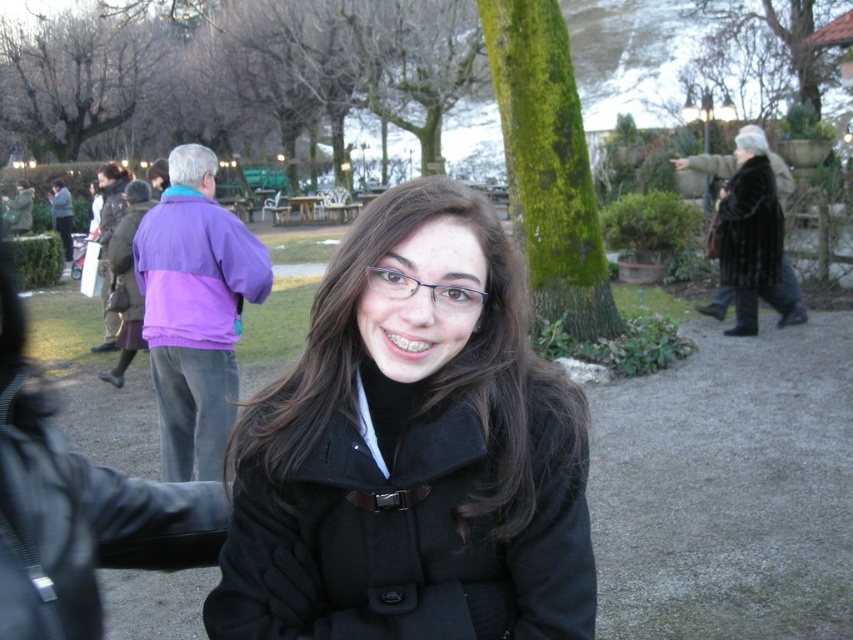
Is black matte coat at lower left wider than black fur coat at right?

Incorrect, black matte coat at lower left's width does not surpass black fur coat at right's.

Is point (45, 592) positioned after point (728, 182)?

No, (45, 592) is closer to viewer.

Identify the location of black matte coat at lower left. (84, 528).

This screenshot has height=640, width=853. I want to click on purple fleece jacket at left, so coord(126,262).

Can you confirm if purple fleece jacket at left is positioned to the right of smooth gray stone hand at upper right?

Incorrect, purple fleece jacket at left is not on the right side of smooth gray stone hand at upper right.

Who is more forward, (125, 257) or (686, 157)?

Point (125, 257) is in front.

At what (x,y) coordinates should I click in order to perform the action: click on purple fleece jacket at left. Please return your answer as a coordinate pair (x, y). Image resolution: width=853 pixels, height=640 pixels. Looking at the image, I should click on (126, 262).

From the picture: Who is more distant from viewer, (x=727, y=260) or (x=775, y=186)?

Positioned behind is point (x=727, y=260).

Between black fur coat at right and velvet brown coat at upper right, which one appears on the right side from the viewer's perspective?

velvet brown coat at upper right is more to the right.

Who is more forward, (773, 266) or (781, 180)?

Positioned in front is point (773, 266).

Locate an element on the screen. The image size is (853, 640). black fur coat at right is located at coordinates (747, 228).